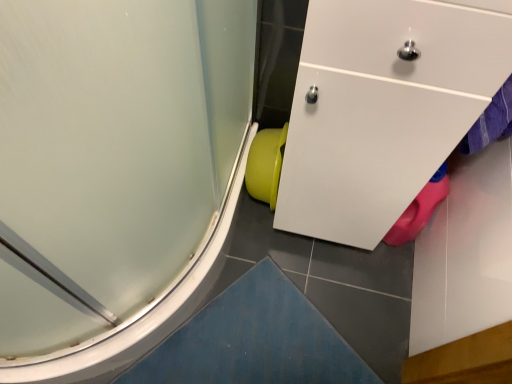
Question: Is frosted glass shower door at lower left wider than matte plastic toilet bowl at lower center?

Choices:
 (A) no
 (B) yes

Answer: (B)

Question: Is frosted glass shower door at lower left outside of matte plastic toilet bowl at lower center?

Choices:
 (A) yes
 (B) no

Answer: (A)

Question: Is frosted glass shower door at lower left looking in the opposite direction of matte plastic toilet bowl at lower center?

Choices:
 (A) yes
 (B) no

Answer: (B)

Question: Is matte plastic toilet bowl at lower center located within frosted glass shower door at lower left?

Choices:
 (A) yes
 (B) no

Answer: (B)

Question: Can you confirm if frosted glass shower door at lower left is thinner than matte plastic toilet bowl at lower center?

Choices:
 (A) no
 (B) yes

Answer: (A)

Question: Could you tell me if frosted glass shower door at lower left is turned towards matte plastic toilet bowl at lower center?

Choices:
 (A) yes
 (B) no

Answer: (B)

Question: Is matte plastic toilet bowl at lower center placed right next to frosted glass shower door at lower left?

Choices:
 (A) yes
 (B) no

Answer: (B)

Question: Is matte plastic toilet bowl at lower center completely or partially outside of frosted glass shower door at lower left?

Choices:
 (A) no
 (B) yes

Answer: (B)

Question: From the image's perspective, is matte plastic toilet bowl at lower center above frosted glass shower door at lower left?

Choices:
 (A) yes
 (B) no

Answer: (B)

Question: Is matte plastic toilet bowl at lower center oriented away from frosted glass shower door at lower left?

Choices:
 (A) yes
 (B) no

Answer: (B)

Question: From a real-world perspective, is matte plastic toilet bowl at lower center on frosted glass shower door at lower left?

Choices:
 (A) yes
 (B) no

Answer: (B)

Question: Is matte plastic toilet bowl at lower center taller than frosted glass shower door at lower left?

Choices:
 (A) no
 (B) yes

Answer: (A)

Question: Is frosted glass shower door at lower left in front of or behind matte plastic toilet bowl at lower center in the image?

Choices:
 (A) front
 (B) behind

Answer: (A)